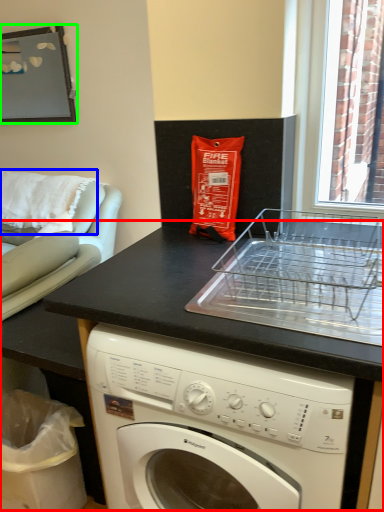
Question: Which is farther away from counter (highlighted by a red box)? pillow (highlighted by a blue box) or picture frame (highlighted by a green box)?

Choices:
 (A) pillow
 (B) picture frame

Answer: (B)